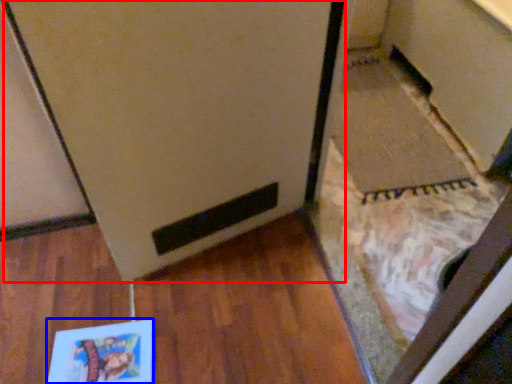
Question: Which object appears farthest to the camera in this image, fridge (highlighted by a red box) or book (highlighted by a blue box)?

Choices:
 (A) fridge
 (B) book

Answer: (B)